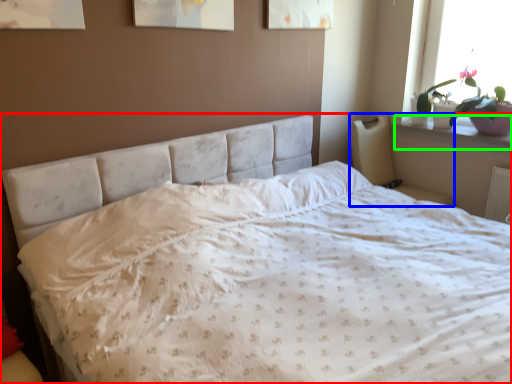
Question: Which object is positioned closest to bed (highlighted by a red box)? Select from armchair (highlighted by a blue box) and window sill (highlighted by a green box).

Choices:
 (A) armchair
 (B) window sill

Answer: (A)